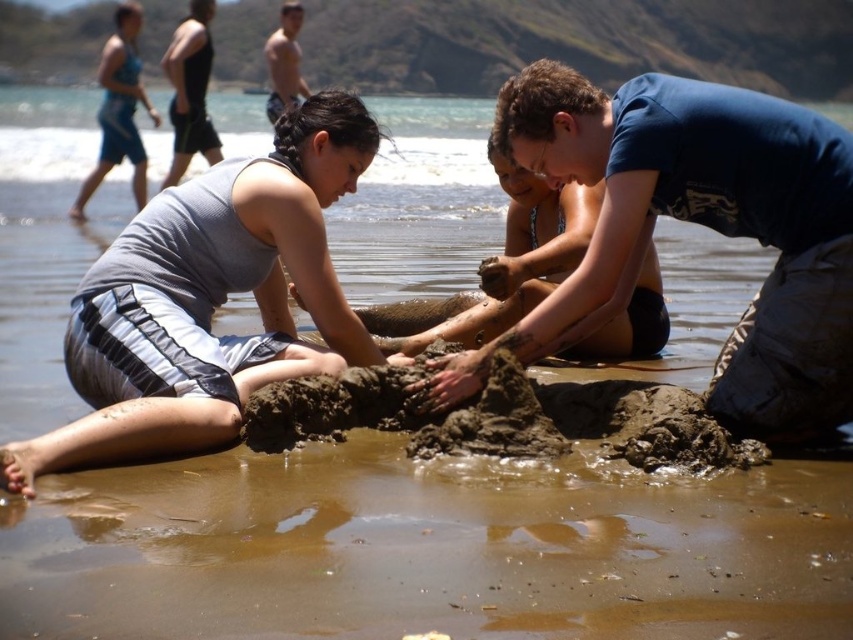
Question: From the image, what is the correct spatial relationship of black tank top at upper left in relation to skinny man at upper center?

Choices:
 (A) above
 (B) below

Answer: (B)

Question: Is blue cotton shirt at upper right further to the viewer compared to blue fabric swimsuit at upper left?

Choices:
 (A) yes
 (B) no

Answer: (B)

Question: Which object is the closest to the black tank top at upper left?

Choices:
 (A) gray matte tank top at center
 (B) skinny man at upper center
 (C) blue cotton shirt at upper right
 (D) blue fabric swimsuit at upper left

Answer: (D)

Question: Which object is closer to the camera taking this photo?

Choices:
 (A) blue cotton shirt at upper right
 (B) black tank top at upper left
 (C) gray matte tank top at center

Answer: (C)

Question: Which of the following is the farthest from the observer?

Choices:
 (A) gray matte tank top at center
 (B) black tank top at upper left
 (C) skinny man at upper center
 (D) blue fabric swimsuit at upper left

Answer: (C)

Question: Is gray matte tank top at center closer to camera compared to black tank top at upper left?

Choices:
 (A) yes
 (B) no

Answer: (A)